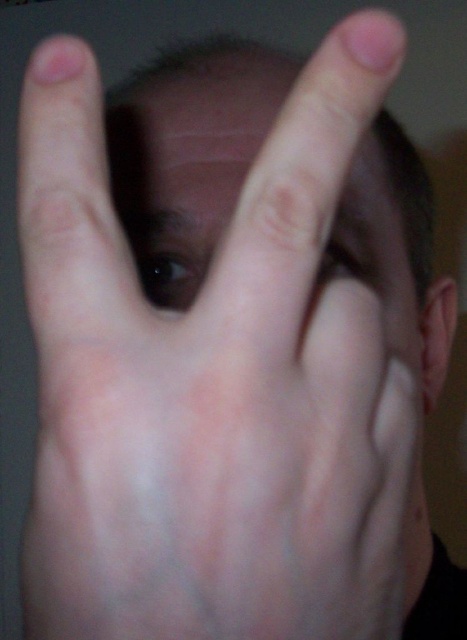
How much distance is there between black glossy eye at center and matte skin eye at center?

A distance of 2.60 inches exists between black glossy eye at center and matte skin eye at center.

Between black glossy eye at center and matte skin eye at center, which one is positioned lower?

black glossy eye at center is below.

Is point (154, 280) farther from viewer compared to point (369, 253)?

No, (154, 280) is closer to viewer.

Find the location of a particular element. This screenshot has width=467, height=640. black glossy eye at center is located at coordinates (169, 276).